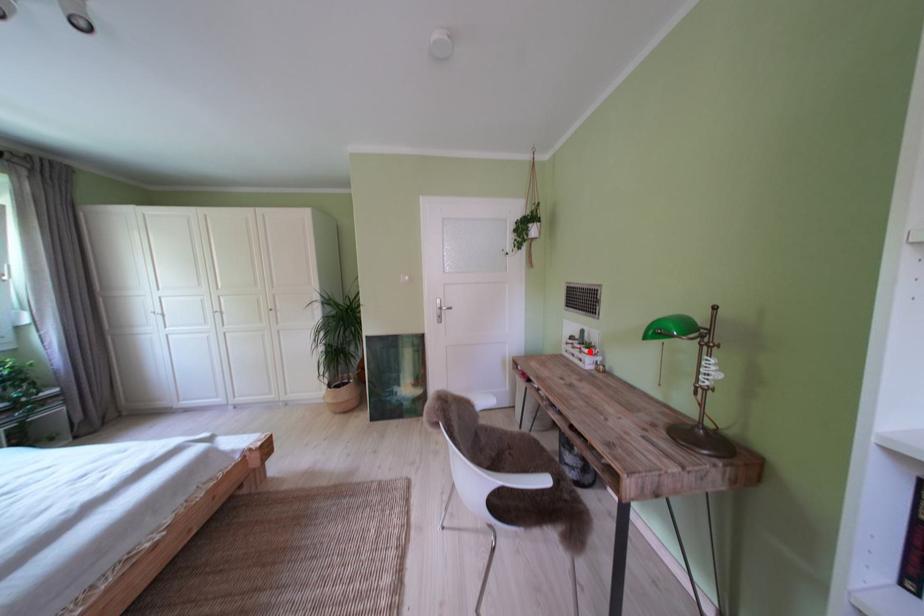
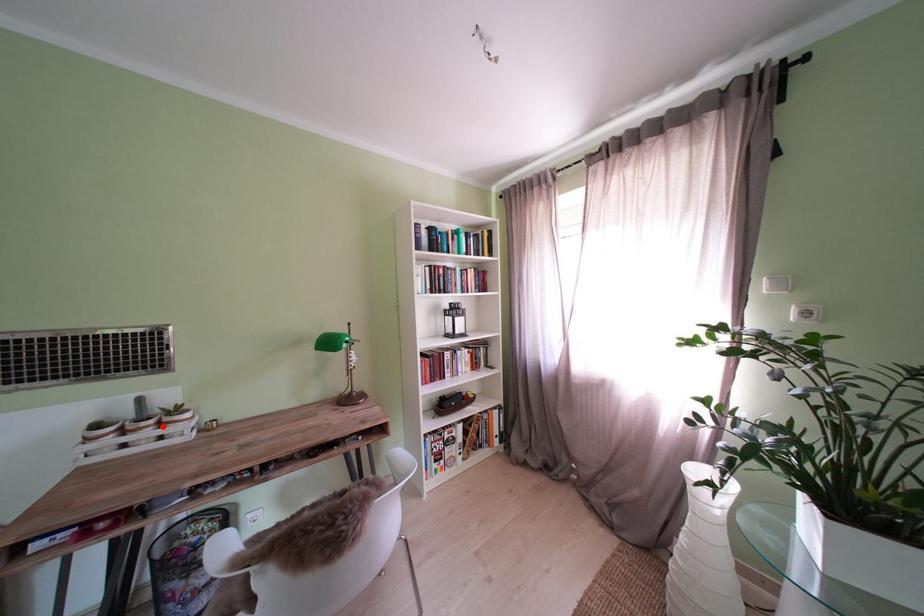
Looking at this image, I am providing you with two images of the same scene from different viewpoints. A red point is marked on the first image and another point is marked on the second image. Are the points marked in image1 and image2 representing the same 3D position?

Yes